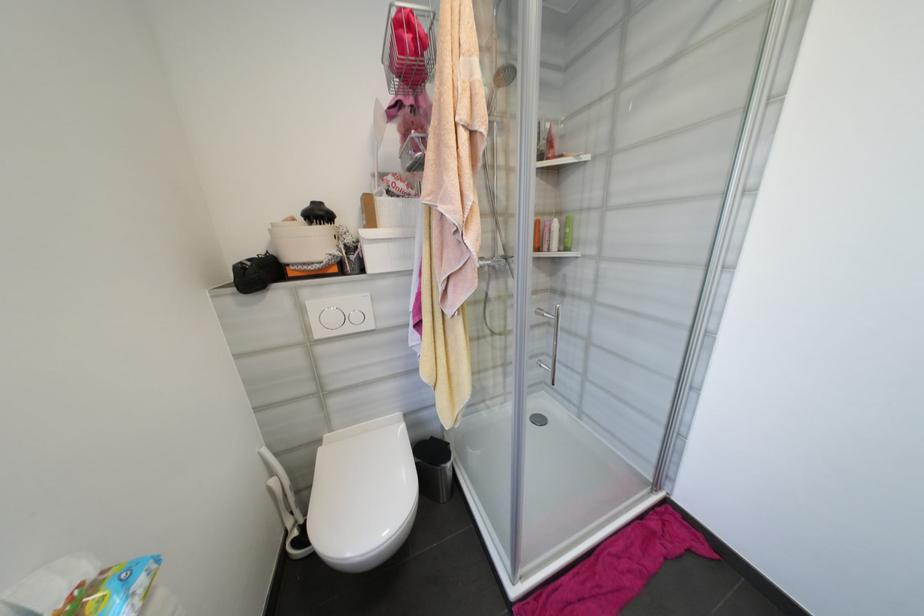
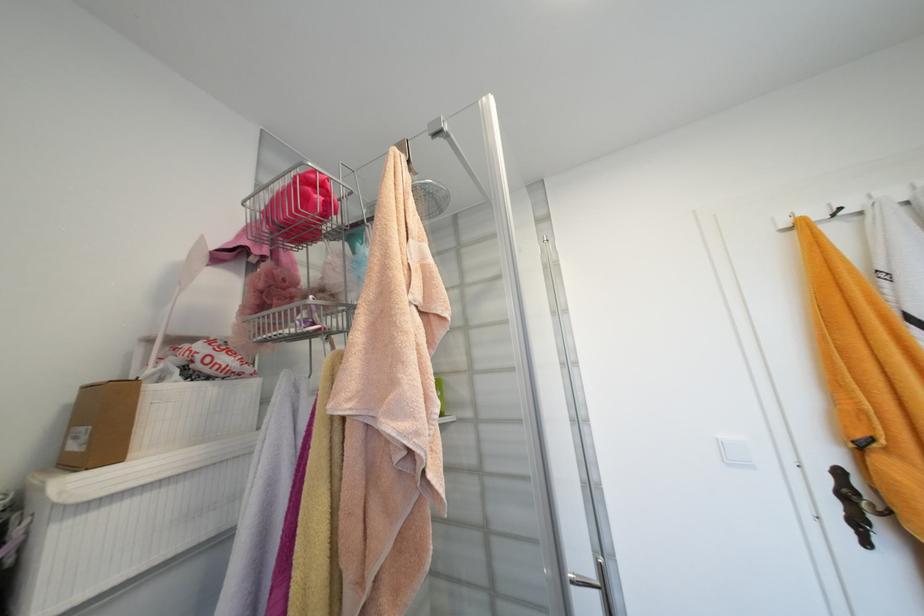
The point at (x=380, y=177) is marked in the first image. Where is the corresponding point in the second image?

(154, 342)